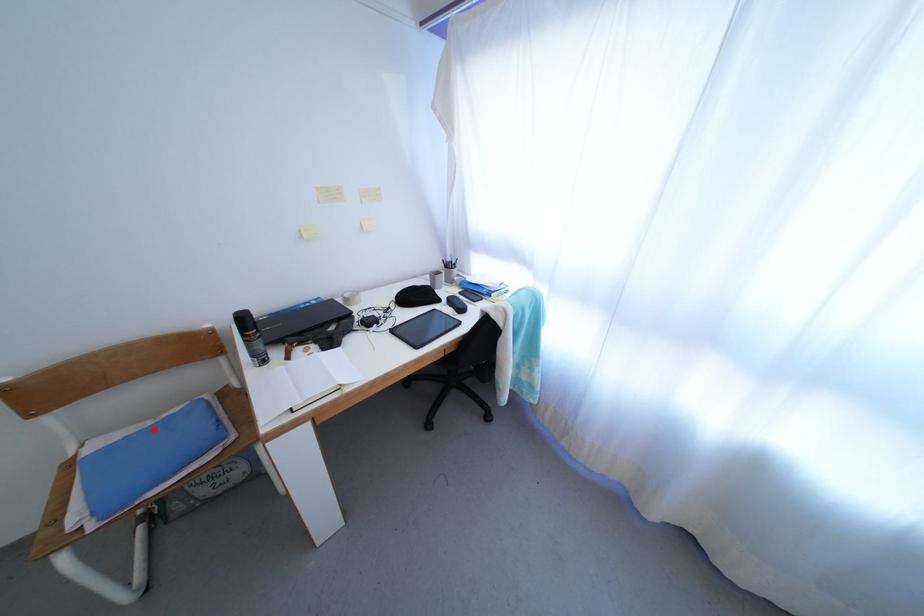
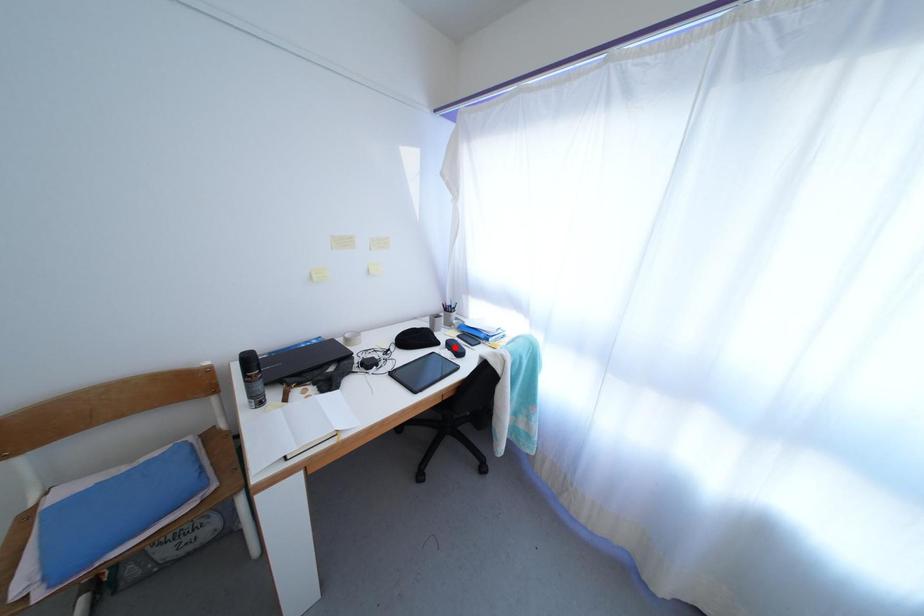
I am providing you with two images of the same scene from different viewpoints. A red point is marked on the first image and another point is marked on the second image. Do the highlighted points in image1 and image2 indicate the same real-world spot?

No